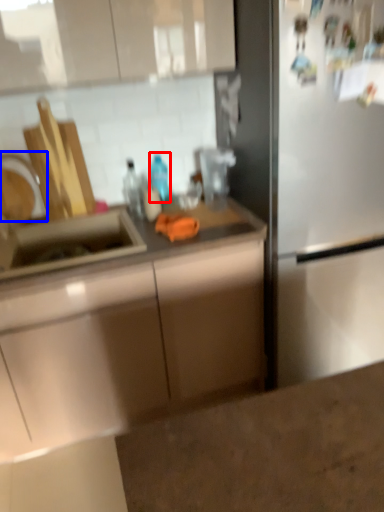
Question: Which object appears farthest to the camera in this image, bottle (highlighted by a red box) or faucet (highlighted by a blue box)?

Choices:
 (A) bottle
 (B) faucet

Answer: (A)